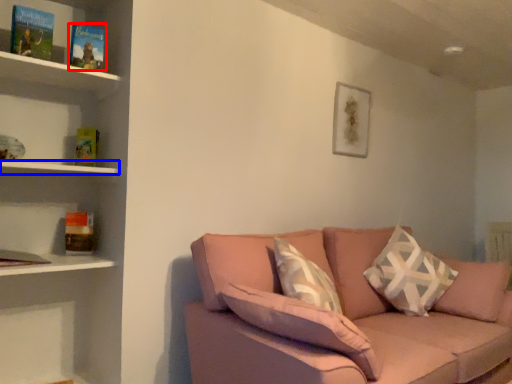
Question: Among these objects, which one is farthest to the camera, paperback book (highlighted by a red box) or shelf (highlighted by a blue box)?

Choices:
 (A) paperback book
 (B) shelf

Answer: (A)